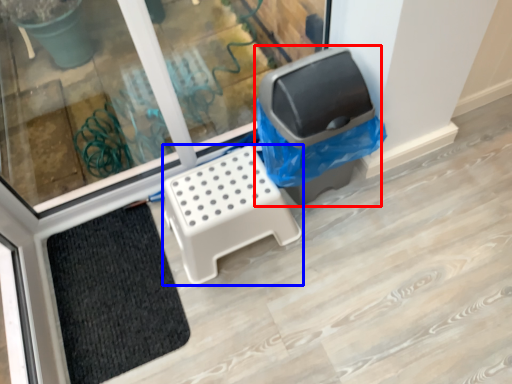
Question: Which of the following is the farthest to the observer, recycling bin (highlighted by a red box) or furniture (highlighted by a blue box)?

Choices:
 (A) recycling bin
 (B) furniture

Answer: (B)